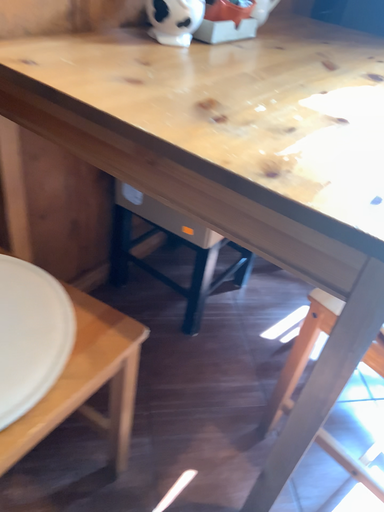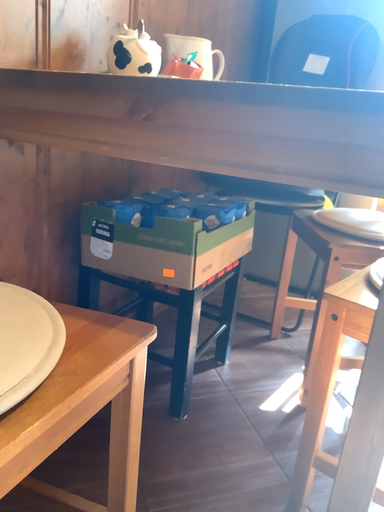
Question: Which way did the camera rotate in the video?

Choices:
 (A) rotated upward
 (B) rotated downward

Answer: (A)